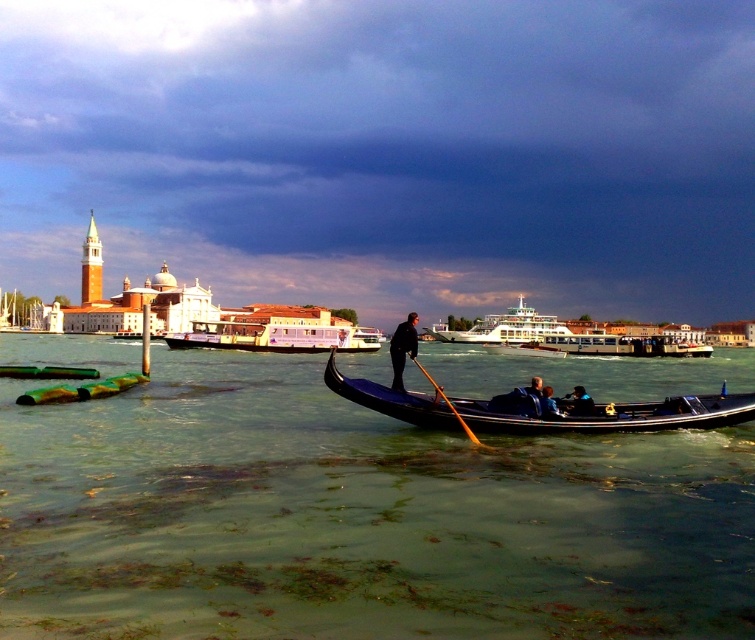
Is cloudy sky at upper center above purple glossy ferry at center?

Correct, cloudy sky at upper center is located above purple glossy ferry at center.

Is point (479, 129) farther from viewer compared to point (344, 349)?

Yes, it is.

Locate an element on the screen. The width and height of the screenshot is (755, 640). cloudy sky at upper center is located at coordinates 387,152.

Consider the image. Between cloudy sky at upper center and green algae water at center, which one appears on the left side from the viewer's perspective?

cloudy sky at upper center is more to the left.

Is cloudy sky at upper center positioned in front of green algae water at center?

No.

At what (x,y) coordinates should I click in order to perform the action: click on cloudy sky at upper center. Please return your answer as a coordinate pair (x, y). This screenshot has width=755, height=640. Looking at the image, I should click on coord(387,152).

From the picture: Can you confirm if shiny black gondola at center is wider than purple glossy ferry at center?

No.

Where is `shiny black gondola at center`? The width and height of the screenshot is (755, 640). shiny black gondola at center is located at coordinates (606, 413).